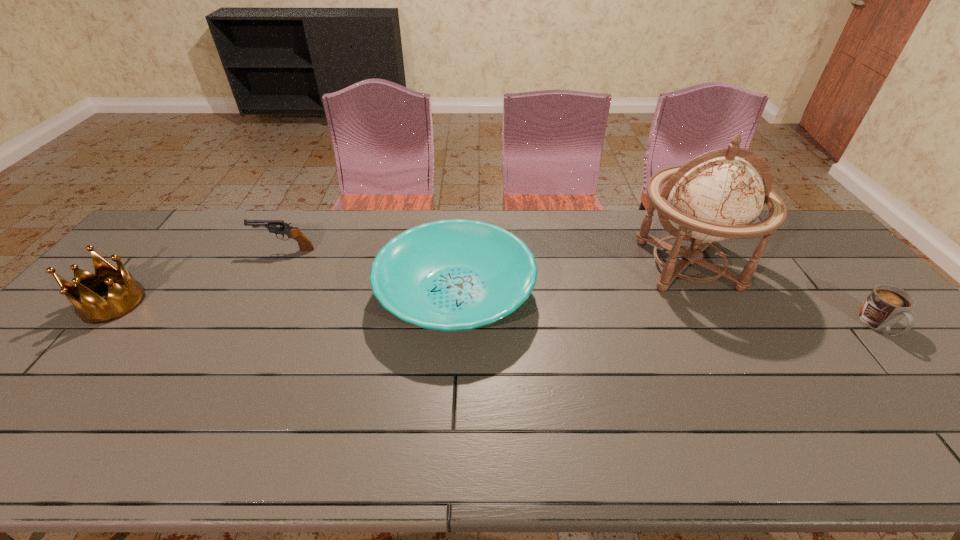
The width and height of the screenshot is (960, 540). What are the coordinates of `vacant space at the near edge of the desktop` in the screenshot? It's located at (620, 446).

Locate an element on the screen. Image resolution: width=960 pixels, height=540 pixels. vacant area at the left edge is located at coordinates (154, 272).

Find the location of a particular element. This screenshot has width=960, height=540. vacant space at the far left corner of the desktop is located at coordinates (190, 243).

Locate an element on the screen. vacant point located between the fourth object from left to right and the dish is located at coordinates (571, 279).

Find the location of a particular element. vacant area between the dish and the crown is located at coordinates (284, 299).

Identify the location of free spot between the mug and the third object from left to right. This screenshot has height=540, width=960. (667, 310).

Image resolution: width=960 pixels, height=540 pixels. I want to click on free spot between the leftmost object and the gun, so click(199, 276).

This screenshot has height=540, width=960. I want to click on blank region between the globe and the mug, so click(782, 295).

Locate an element on the screen. Image resolution: width=960 pixels, height=540 pixels. empty location between the tallest object and the rightmost object is located at coordinates (782, 295).

You are a GUI agent. You are given a task and a screenshot of the screen. Output one action in this format:
    pyautogui.click(x=<x>, y=<y>)
    Task: Click on the empty space that is in between the fourth shortest object and the third object from left to right
    Image resolution: width=960 pixels, height=540 pixels.
    Given the screenshot: What is the action you would take?
    pyautogui.click(x=284, y=299)